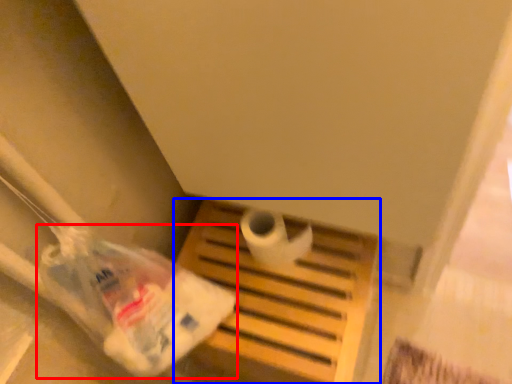
Question: Which point is further to the camera, plastic bag (highlighted by a red box) or furniture (highlighted by a blue box)?

Choices:
 (A) plastic bag
 (B) furniture

Answer: (B)